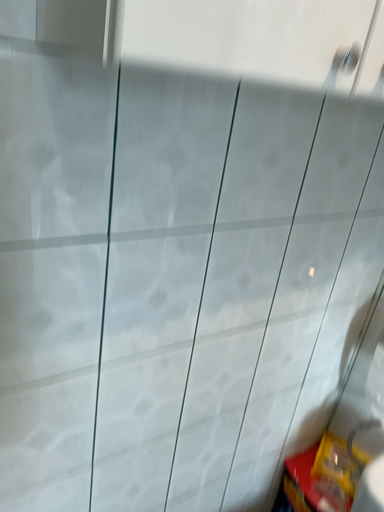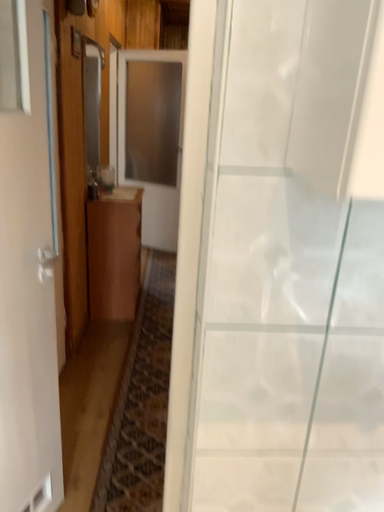
Question: Which way did the camera rotate in the video?

Choices:
 (A) rotated downward
 (B) rotated upward

Answer: (B)